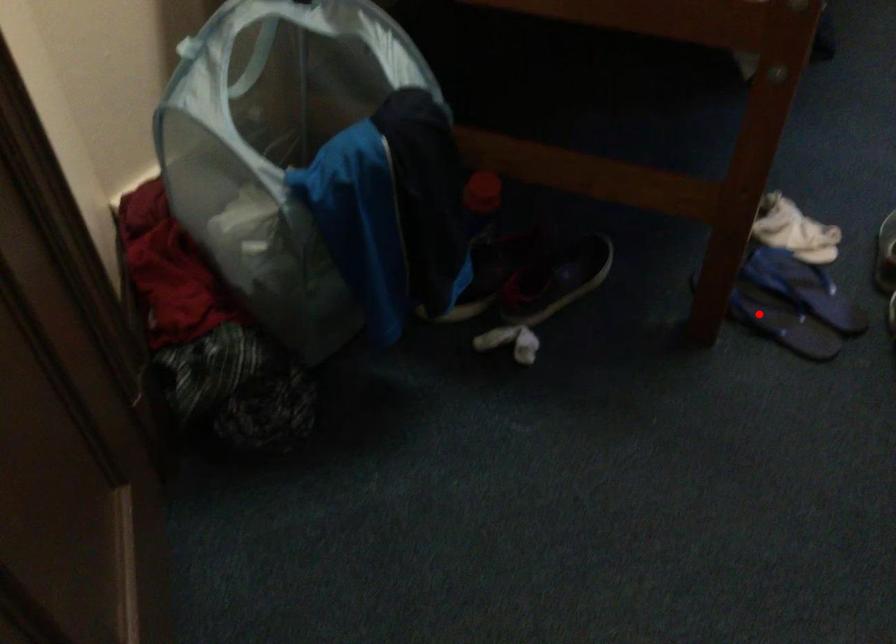
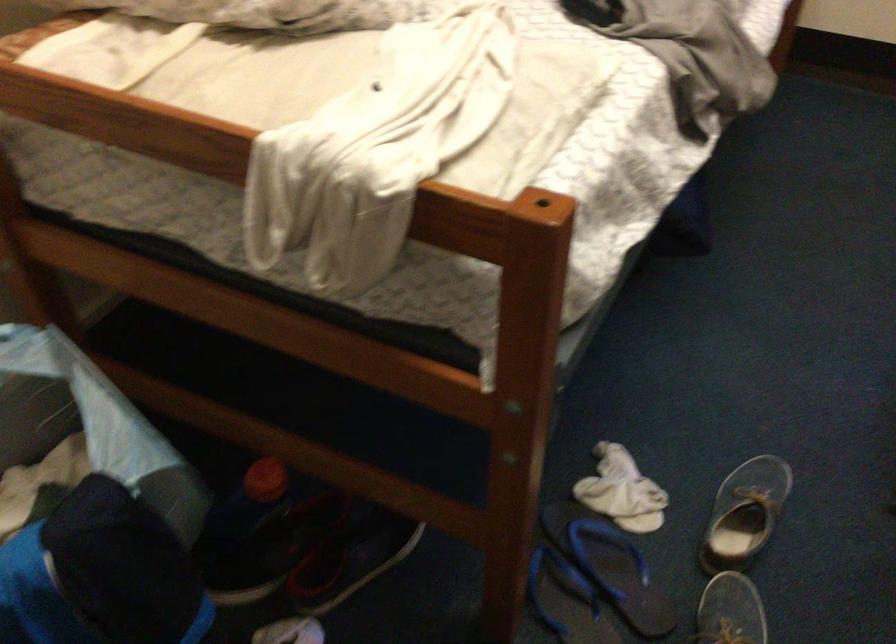
Find the pixel in the second image that matches the highlighted location in the first image.

(566, 600)